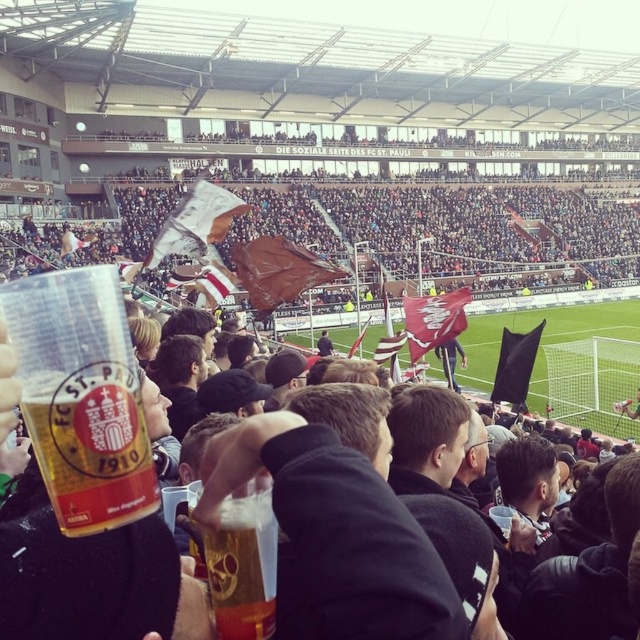
Who is lower down, black fabric jacket at center or translucent plastic cup at center?

translucent plastic cup at center

Can you confirm if black fabric jacket at center is bigger than translucent plastic cup at center?

Yes, black fabric jacket at center is bigger than translucent plastic cup at center.

Image resolution: width=640 pixels, height=640 pixels. Describe the element at coordinates (337, 522) in the screenshot. I see `black fabric jacket at center` at that location.

Locate an element on the screen. black fabric jacket at center is located at coordinates (337, 522).

Which of these two, brown fabric flags at upper center or translucent plastic cup at center, stands taller?

brown fabric flags at upper center

Is brown fabric flags at upper center below translucent plastic cup at center?

No, brown fabric flags at upper center is not below translucent plastic cup at center.

Is point (316, 196) positioned in front of point (248, 536)?

No, (316, 196) is behind (248, 536).

Find the location of a particular element. brown fabric flags at upper center is located at coordinates (456, 227).

Which of these two, black fabric jacket at center or green grass football field at center, stands taller?

green grass football field at center

Is black fabric jacket at center thinner than green grass football field at center?

Correct, black fabric jacket at center's width is less than green grass football field at center's.

Describe the element at coordinates (337, 522) in the screenshot. This screenshot has height=640, width=640. I see `black fabric jacket at center` at that location.

At what (x,y) coordinates should I click in order to perform the action: click on black fabric jacket at center. Please return your answer as a coordinate pair (x, y). Image resolution: width=640 pixels, height=640 pixels. Looking at the image, I should click on (337, 522).